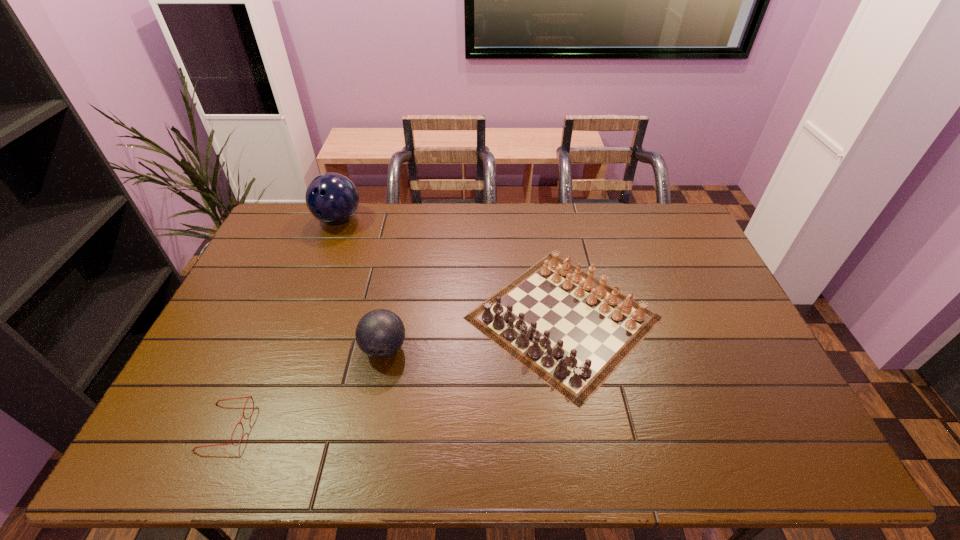
Find the location of `vacant area located on the face of the shortest object`. vacant area located on the face of the shortest object is located at coordinates (354, 427).

I want to click on object that is at the far edge, so click(x=332, y=198).

Locate an element on the screen. Image resolution: width=960 pixels, height=540 pixels. object that is at the near edge is located at coordinates (248, 397).

The width and height of the screenshot is (960, 540). Identify the location of bowling ball that is at the left edge. (332, 198).

You are a GUI agent. You are given a task and a screenshot of the screen. Output one action in this format:
    pyautogui.click(x=<x>, y=<y>)
    Task: Click on the spectacles that is at the left edge
    This screenshot has width=960, height=540.
    Given the screenshot: What is the action you would take?
    pyautogui.click(x=248, y=397)

Find the location of a particular element. This screenshot has height=540, width=960. object located in the far left corner section of the desktop is located at coordinates (332, 198).

Identify the location of object that is at the near left corner. (248, 397).

In the image, there is a desktop. Where is `vacant space at the far edge`? vacant space at the far edge is located at coordinates (434, 232).

At what (x,y) coordinates should I click in order to perform the action: click on vacant region at the near edge of the desktop. Please return your answer as a coordinate pair (x, y). Looking at the image, I should click on (398, 461).

The height and width of the screenshot is (540, 960). Identify the location of vacant space at the left edge. (243, 284).